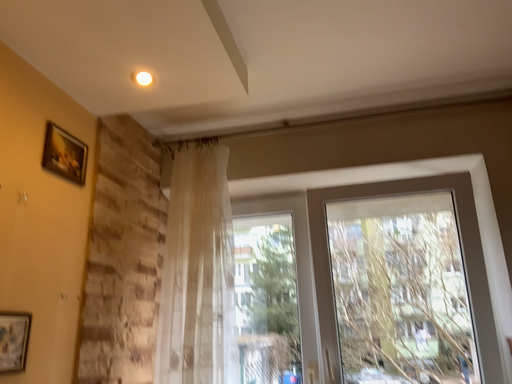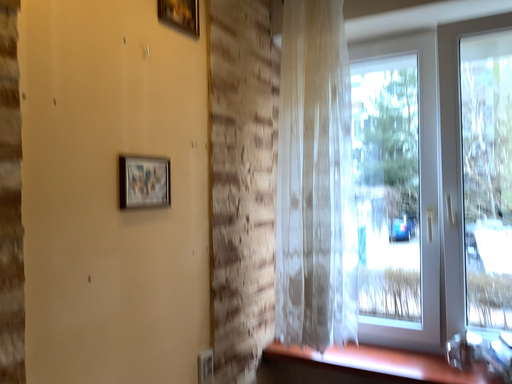
Question: Which way did the camera rotate in the video?

Choices:
 (A) rotated left
 (B) rotated right

Answer: (A)